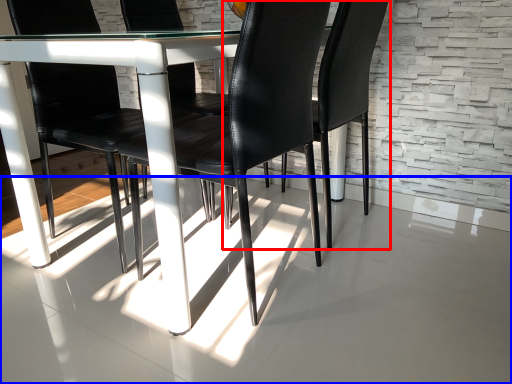
Question: Which of the following is the farthest to the observer, chair (highlighted by a red box) or concrete (highlighted by a blue box)?

Choices:
 (A) chair
 (B) concrete

Answer: (A)